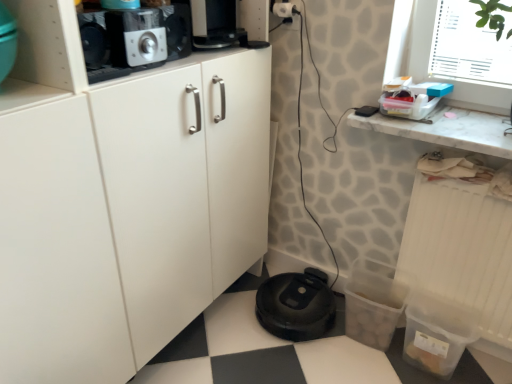
Question: Is white plastic window screen at upper right not close to white plastic electric outlet at upper right?

Choices:
 (A) no
 (B) yes

Answer: (A)

Question: Would you say white plastic window screen at upper right contains white plastic electric outlet at upper right?

Choices:
 (A) yes
 (B) no

Answer: (B)

Question: Considering the relative sizes of white plastic window screen at upper right and white plastic electric outlet at upper right in the image provided, is white plastic window screen at upper right bigger than white plastic electric outlet at upper right?

Choices:
 (A) no
 (B) yes

Answer: (B)

Question: Is white plastic window screen at upper right closer to camera compared to white plastic electric outlet at upper right?

Choices:
 (A) yes
 (B) no

Answer: (A)

Question: Is white plastic window screen at upper right beside white plastic electric outlet at upper right?

Choices:
 (A) no
 (B) yes

Answer: (A)

Question: From the image's perspective, is transparent plastic container at lower right located above or below white marble countertop at upper right?

Choices:
 (A) below
 (B) above

Answer: (A)

Question: Would you say transparent plastic container at lower right is to the left or to the right of white marble countertop at upper right in the picture?

Choices:
 (A) right
 (B) left

Answer: (A)

Question: Is transparent plastic container at lower right taller or shorter than white marble countertop at upper right?

Choices:
 (A) tall
 (B) short

Answer: (A)

Question: Considering their positions, is transparent plastic container at lower right located in front of or behind white marble countertop at upper right?

Choices:
 (A) front
 (B) behind

Answer: (A)

Question: Visually, is white plastic window screen at upper right positioned to the left or to the right of black plastic robot vacuum cleaner at lower center?

Choices:
 (A) left
 (B) right

Answer: (B)

Question: Is white plastic window screen at upper right situated inside black plastic robot vacuum cleaner at lower center or outside?

Choices:
 (A) outside
 (B) inside

Answer: (A)

Question: Based on their sizes in the image, would you say white plastic window screen at upper right is bigger or smaller than black plastic robot vacuum cleaner at lower center?

Choices:
 (A) big
 (B) small

Answer: (A)

Question: From a real-world perspective, is white plastic window screen at upper right above or below black plastic robot vacuum cleaner at lower center?

Choices:
 (A) above
 (B) below

Answer: (A)

Question: Considering the positions of white plastic window screen at upper right and brushed metal toaster at upper left in the image, is white plastic window screen at upper right wider or thinner than brushed metal toaster at upper left?

Choices:
 (A) thin
 (B) wide

Answer: (B)

Question: From the image's perspective, is white plastic window screen at upper right located above or below brushed metal toaster at upper left?

Choices:
 (A) above
 (B) below

Answer: (B)